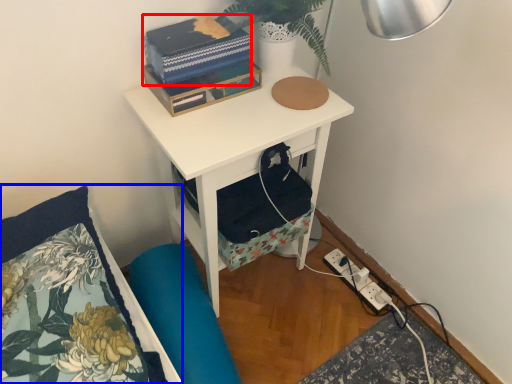
Question: Among these objects, which one is nearest to the camera, book (highlighted by a red box) or pillow (highlighted by a blue box)?

Choices:
 (A) book
 (B) pillow

Answer: (B)